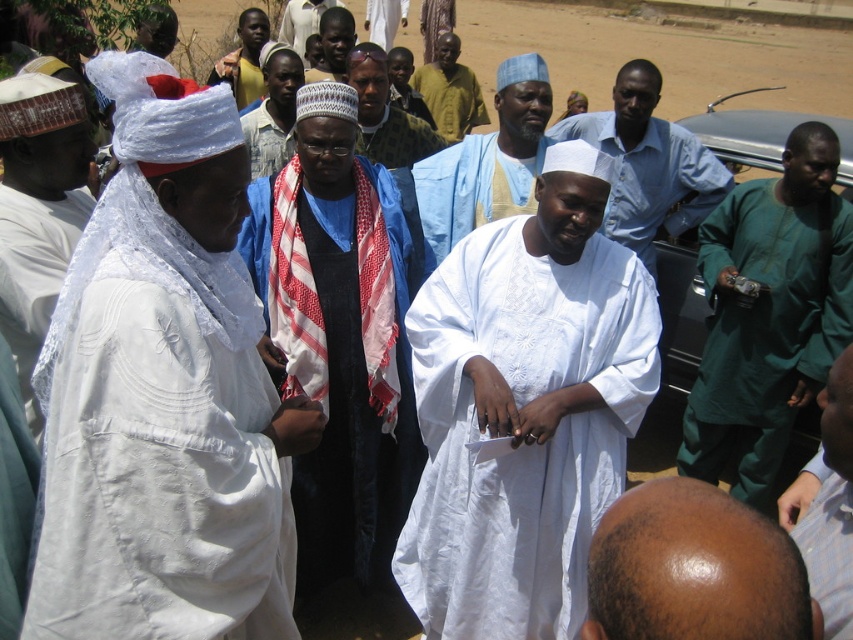
Question: Is green satin shirt at right to the left of yellow textured shirt at center from the viewer's perspective?

Choices:
 (A) no
 (B) yes

Answer: (A)

Question: Which point is closer to the camera taking this photo?

Choices:
 (A) pos(604,112)
 (B) pos(821,339)

Answer: (B)

Question: Does red and white woven scarf at center have a smaller size compared to green satin shirt at right?

Choices:
 (A) yes
 (B) no

Answer: (B)

Question: Does green satin shirt at right have a lesser width compared to white lace cloth at left?

Choices:
 (A) yes
 (B) no

Answer: (B)

Question: Which point is farther from the camera taking this photo?

Choices:
 (A) (612, 131)
 (B) (744, 620)
 (C) (383, 140)
 (D) (326, 426)

Answer: (C)

Question: Which of the following is the farthest from the observer?

Choices:
 (A) (572, 563)
 (B) (381, 220)
 (C) (523, 145)

Answer: (C)